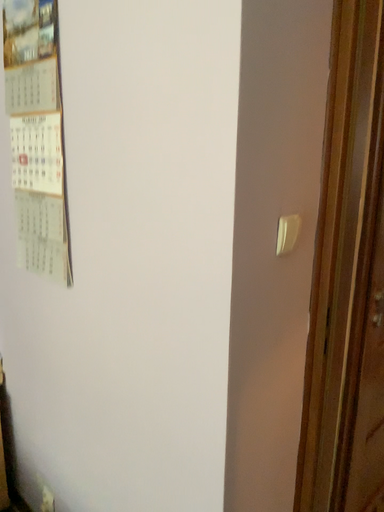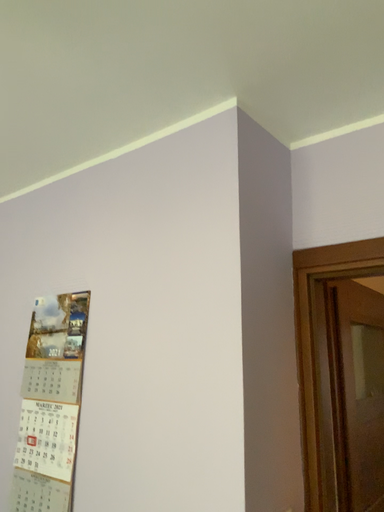
Question: Which way did the camera rotate in the video?

Choices:
 (A) rotated downward
 (B) rotated upward

Answer: (B)